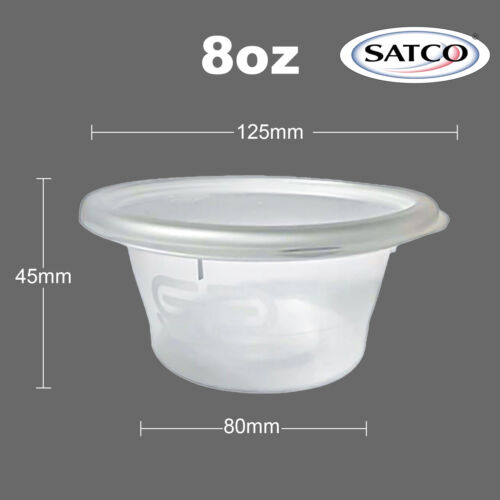
The image size is (500, 500). What are the coordinates of `units` in the screenshot? It's located at (286, 136), (262, 61), (53, 280), (264, 426).